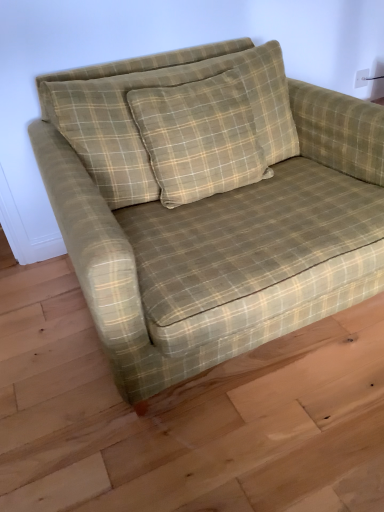
What do you see at coordinates (209, 203) in the screenshot?
I see `green plaid fabric couch at center` at bounding box center [209, 203].

What do you see at coordinates (151, 86) in the screenshot? The width and height of the screenshot is (384, 512). I see `green plaid pillow at center` at bounding box center [151, 86].

Describe the element at coordinates (361, 78) in the screenshot. I see `white plastic electric outlet at upper right` at that location.

In order to click on green plaid fabric couch at center in this screenshot , I will do `click(209, 203)`.

Who is shorter, white plastic electric outlet at upper right or green plaid fabric couch at center?

Standing shorter between the two is white plastic electric outlet at upper right.

Which object is positioned more to the left, white plastic electric outlet at upper right or green plaid fabric couch at center?

From the viewer's perspective, green plaid fabric couch at center appears more on the left side.

Considering the relative sizes of white plastic electric outlet at upper right and green plaid fabric couch at center in the image provided, is white plastic electric outlet at upper right smaller than green plaid fabric couch at center?

Yes.

Where is `electric outlet above the green plaid fabric couch at center (from a real-world perspective)`? The image size is (384, 512). electric outlet above the green plaid fabric couch at center (from a real-world perspective) is located at coordinates (361, 78).

Can you confirm if green plaid pillow at center is positioned to the right of green plaid fabric couch at center?

No.

From the image's perspective, is green plaid pillow at center beneath green plaid fabric couch at center?

Actually, green plaid pillow at center appears above green plaid fabric couch at center in the image.

Considering the sizes of objects green plaid pillow at center and green plaid fabric couch at center in the image provided, who is thinner, green plaid pillow at center or green plaid fabric couch at center?

green plaid pillow at center.

Between green plaid pillow at center and green plaid fabric couch at center, which one has less height?

green plaid pillow at center.

Considering their positions, is green plaid fabric couch at center located in front of or behind white plastic electric outlet at upper right?

Clearly, green plaid fabric couch at center is in front of white plastic electric outlet at upper right.

From the picture: Is green plaid fabric couch at center looking in the opposite direction of white plastic electric outlet at upper right?

No, green plaid fabric couch at center is not facing away from white plastic electric outlet at upper right.

Based on the photo, is green plaid fabric couch at center next to white plastic electric outlet at upper right and touching it?

No, green plaid fabric couch at center is not touching white plastic electric outlet at upper right.

Where is `studio couch below the white plastic electric outlet at upper right (from a real-world perspective)`? Image resolution: width=384 pixels, height=512 pixels. studio couch below the white plastic electric outlet at upper right (from a real-world perspective) is located at coordinates (209, 203).

Measure the distance between green plaid fabric couch at center and green plaid pillow at center.

The distance of green plaid fabric couch at center from green plaid pillow at center is 7.80 inches.

From the image's perspective, which one is positioned higher, green plaid fabric couch at center or green plaid pillow at center?

green plaid pillow at center.

Is green plaid fabric couch at center next to green plaid pillow at center and touching it?

No.

From the picture: Is the position of green plaid fabric couch at center more distant than that of green plaid pillow at center?

That is False.

Which of these two, green plaid pillow at center or white plastic electric outlet at upper right, stands taller?

Standing taller between the two is green plaid pillow at center.

Is green plaid pillow at center beside white plastic electric outlet at upper right?

No, green plaid pillow at center is not with white plastic electric outlet at upper right.

From a real-world perspective, is green plaid pillow at center physically above white plastic electric outlet at upper right?

Yes, from a real-world perspective, green plaid pillow at center is over white plastic electric outlet at upper right

Is white plastic electric outlet at upper right bigger or smaller than green plaid pillow at center?

Considering their sizes, white plastic electric outlet at upper right takes up less space than green plaid pillow at center.

Is white plastic electric outlet at upper right in contact with green plaid pillow at center?

No, white plastic electric outlet at upper right is not next to green plaid pillow at center.

What are the coordinates of `electric outlet that appears on the right of green plaid fabric couch at center` in the screenshot? It's located at (361, 78).

Find the location of a particular element. The height and width of the screenshot is (512, 384). studio couch located underneath the green plaid pillow at center (from a real-world perspective) is located at coordinates tap(209, 203).

Looking at the image, which one is located further to green plaid fabric couch at center, green plaid pillow at center or white plastic electric outlet at upper right?

white plastic electric outlet at upper right.

From the image, which object appears to be nearer to green plaid pillow at center, white plastic electric outlet at upper right or green plaid fabric couch at center?

Among the two, green plaid fabric couch at center is located nearer to green plaid pillow at center.

Looking at the image, which one is located closer to white plastic electric outlet at upper right, green plaid pillow at center or green plaid fabric couch at center?

The object closer to white plastic electric outlet at upper right is green plaid pillow at center.

Which object lies nearer to the anchor point green plaid pillow at center, green plaid fabric couch at center or white plastic electric outlet at upper right?

green plaid fabric couch at center.

When comparing their distances from green plaid fabric couch at center, does white plastic electric outlet at upper right or green plaid pillow at center seem closer?

Based on the image, green plaid pillow at center appears to be nearer to green plaid fabric couch at center.

Based on their spatial positions, is green plaid fabric couch at center or green plaid pillow at center closer to white plastic electric outlet at upper right?

green plaid pillow at center.

Identify the location of pillow located between green plaid fabric couch at center and white plastic electric outlet at upper right in the depth direction. The width and height of the screenshot is (384, 512). [x=151, y=86].